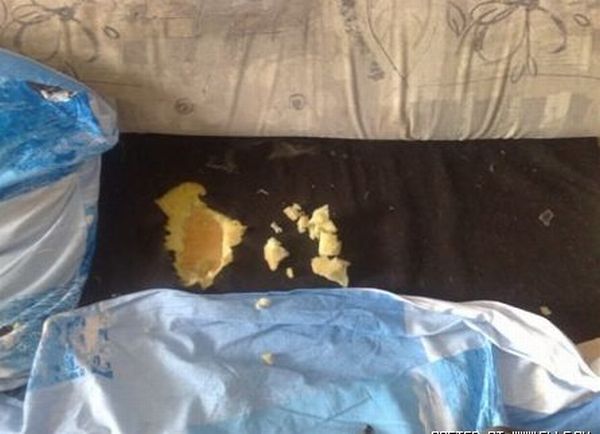
Image resolution: width=600 pixels, height=434 pixels. Identify the location of brown center of brown flower design on fabric. (526, 1), (64, 10).